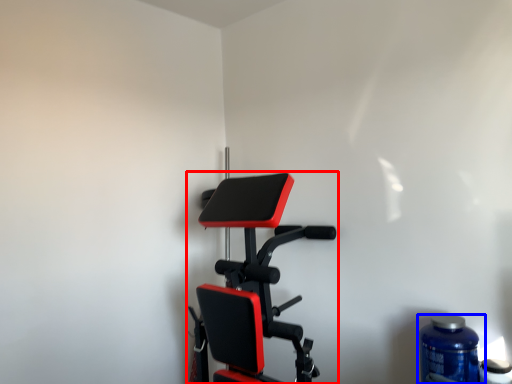
Question: Which of the following is the farthest to the observer, stationary bicycle (highlighted by a red box) or bottle (highlighted by a blue box)?

Choices:
 (A) stationary bicycle
 (B) bottle

Answer: (B)